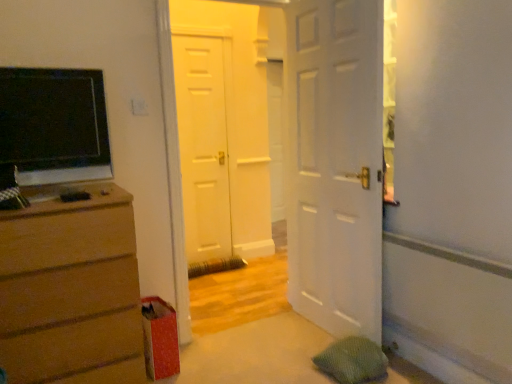
Where is `free space to the left of white matte door at center, the 2th door positioned from the back`? free space to the left of white matte door at center, the 2th door positioned from the back is located at coordinates (212, 319).